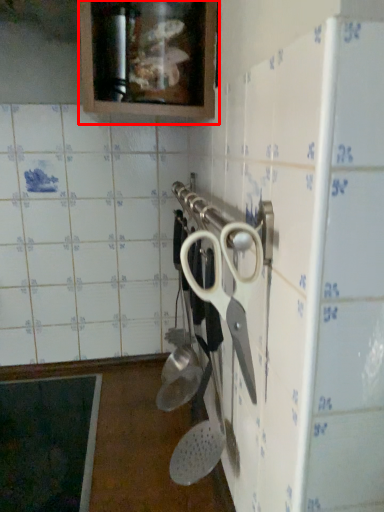
Question: From the image's perspective, considering the relative positions of cabinetry (annotated by the red box) and scissors in the image provided, where is cabinetry (annotated by the red box) located with respect to the staircase?

Choices:
 (A) below
 (B) above

Answer: (B)